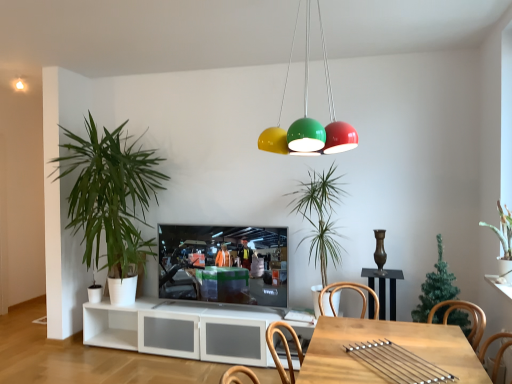
Question: From a real-world perspective, is green matte plant at upper right, which is the 4th houseplant in left-to-right order, located higher than light brown wooden table at lower center?

Choices:
 (A) yes
 (B) no

Answer: (A)

Question: Is green matte plant at upper right, the 1th houseplant in the right-to-left sequence, far from light brown wooden table at lower center?

Choices:
 (A) yes
 (B) no

Answer: (A)

Question: Is green matte plant at upper right, the 1th houseplant in the right-to-left sequence, outside light brown wooden table at lower center?

Choices:
 (A) no
 (B) yes

Answer: (B)

Question: From the image's perspective, would you say green matte plant at upper right, the 1th houseplant in the right-to-left sequence, is positioned over light brown wooden table at lower center?

Choices:
 (A) no
 (B) yes

Answer: (B)

Question: Does green matte plant at upper right, which is the 4th houseplant in left-to-right order, have a smaller size compared to light brown wooden table at lower center?

Choices:
 (A) no
 (B) yes

Answer: (B)

Question: Can you confirm if green matte plant at upper right, which is the 4th houseplant in left-to-right order, is bigger than light brown wooden table at lower center?

Choices:
 (A) yes
 (B) no

Answer: (B)

Question: Is green matte christmas tree at center, the 2th houseplant when ordered from right to left, aimed at matte black television at center?

Choices:
 (A) yes
 (B) no

Answer: (A)

Question: Is green matte christmas tree at center, which appears as the third houseplant when viewed from the left, shorter than matte black television at center?

Choices:
 (A) no
 (B) yes

Answer: (B)

Question: From the image's perspective, is green matte christmas tree at center, which appears as the third houseplant when viewed from the left, below matte black television at center?

Choices:
 (A) no
 (B) yes

Answer: (A)

Question: Is matte black television at center a part of green matte christmas tree at center, the 2th houseplant when ordered from right to left?

Choices:
 (A) yes
 (B) no

Answer: (B)

Question: Can you confirm if green matte christmas tree at center, which appears as the third houseplant when viewed from the left, is positioned to the right of matte black television at center?

Choices:
 (A) yes
 (B) no

Answer: (A)

Question: Is green matte christmas tree at center, the 2th houseplant when ordered from right to left, not inside matte black television at center?

Choices:
 (A) yes
 (B) no

Answer: (A)

Question: From the image's perspective, is matte black television at center on top of green matte christmas tree at center, the 2th houseplant when ordered from right to left?

Choices:
 (A) yes
 (B) no

Answer: (B)